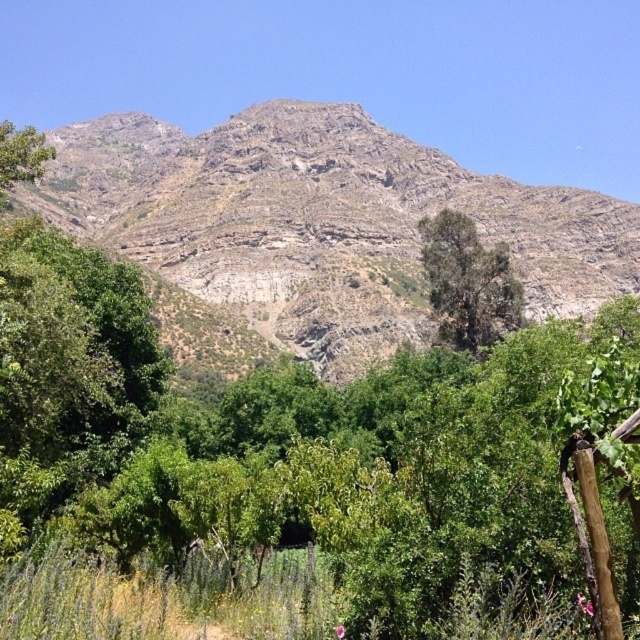
Question: Can you confirm if rocky gray mountain at upper center is bigger than green leafy tree at center?

Choices:
 (A) yes
 (B) no

Answer: (A)

Question: Which object appears farthest from the camera in this image?

Choices:
 (A) green leafy tree at center
 (B) rocky gray mountain at upper center

Answer: (B)

Question: Which point is closer to the camera?

Choices:
 (A) rocky gray mountain at upper center
 (B) green leafy tree at left
 (C) green leafy tree at center

Answer: (B)

Question: Can you confirm if rocky gray mountain at upper center is positioned to the left of green leafy tree at center?

Choices:
 (A) no
 (B) yes

Answer: (B)

Question: Which object is farther from the camera taking this photo?

Choices:
 (A) green leafy tree at center
 (B) green leafy tree at left

Answer: (A)

Question: Can you confirm if green leafy tree at center is positioned to the right of green leafy tree at left?

Choices:
 (A) yes
 (B) no

Answer: (A)